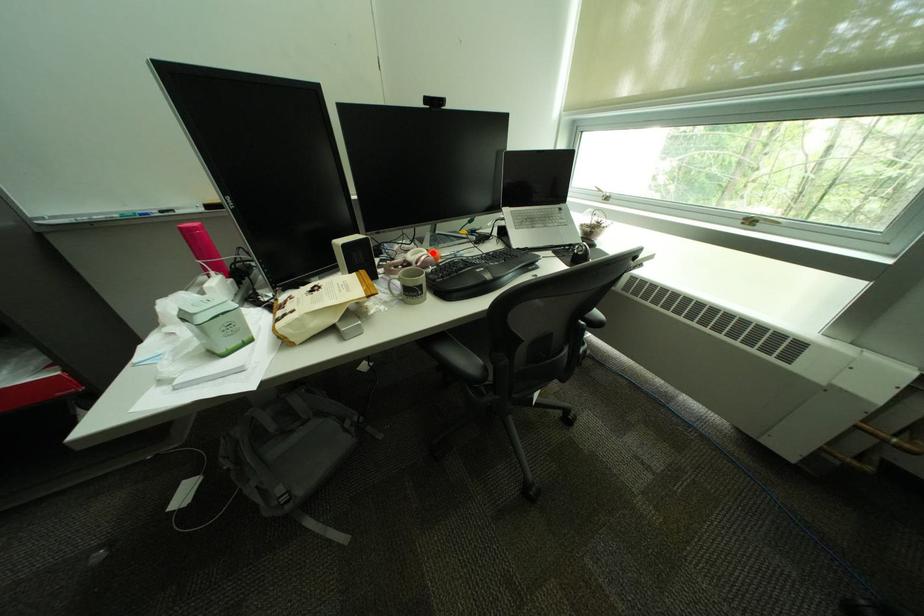
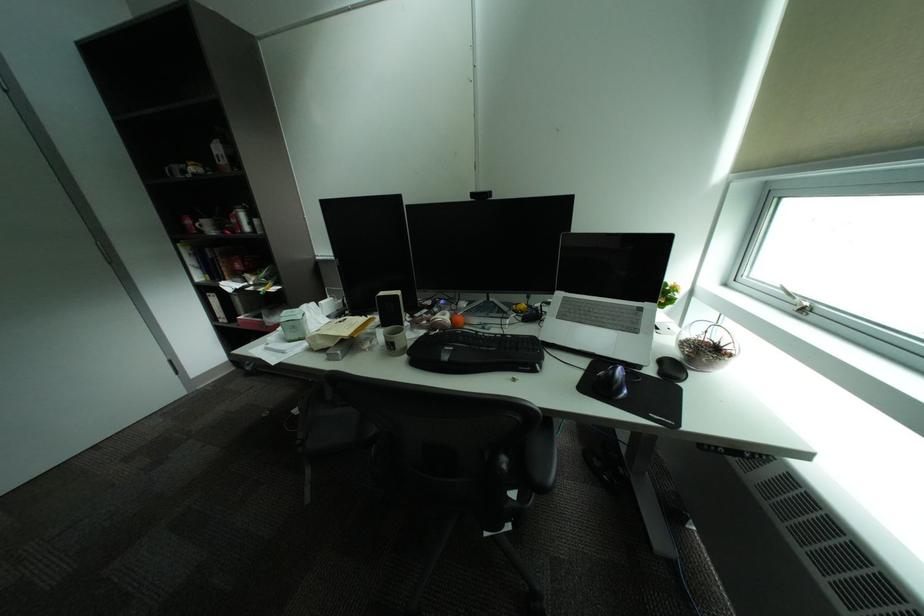
Locate, in the second image, the point that corresponds to the highlighted location in the first image.

(456, 315)